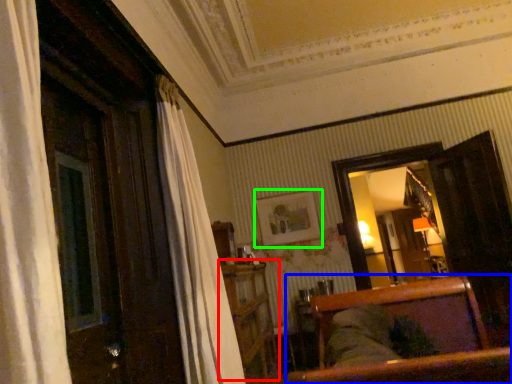
Question: Which object is the closest to the dresser (highlighted by a red box)? Choose among these: furniture (highlighted by a blue box) or picture frame (highlighted by a green box).

Choices:
 (A) furniture
 (B) picture frame

Answer: (A)